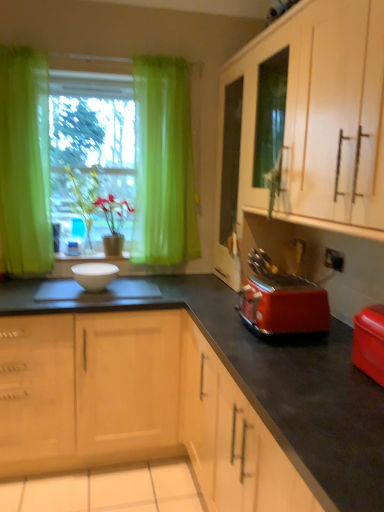
Describe the element at coordinates (91, 256) in the screenshot. The image size is (384, 512). I see `white glossy bowl at center` at that location.

Find the location of a particular element. white glossy bowl at center is located at coordinates (91, 256).

Image resolution: width=384 pixels, height=512 pixels. What are the coordinates of `green leafy plant at center` in the screenshot? It's located at (84, 198).

The image size is (384, 512). Describe the element at coordinates (84, 198) in the screenshot. I see `green leafy plant at center` at that location.

What do you see at coordinates (369, 342) in the screenshot? I see `matte plastic container at lower right` at bounding box center [369, 342].

Where is `white glossy bowl at center`? white glossy bowl at center is located at coordinates (94, 275).

You are a GUI agent. You are given a task and a screenshot of the screen. Output one action in this format:
    pyautogui.click(x=<x>, y=<y>)
    Task: Click on the white glossy bowl at center
    
    Given the screenshot: What is the action you would take?
    pyautogui.click(x=91, y=256)

Is green leafy plant at center in contact with matte plastic container at lower right?

No, green leafy plant at center is not in contact with matte plastic container at lower right.

Can you confirm if green leafy plant at center is thinner than matte plastic container at lower right?

No, green leafy plant at center is not thinner than matte plastic container at lower right.

Can you confirm if green leafy plant at center is positioned to the left of matte plastic container at lower right?

Correct, you'll find green leafy plant at center to the left of matte plastic container at lower right.

Is green leafy plant at center located outside matte plastic container at lower right?

Absolutely, green leafy plant at center is external to matte plastic container at lower right.

Is white glossy bowl at center inside red plastic toaster at lower right?

That's incorrect, white glossy bowl at center is not inside red plastic toaster at lower right.

From the picture: Does red plastic toaster at lower right turn towards white glossy bowl at center?

No, red plastic toaster at lower right is not turned towards white glossy bowl at center.

Considering the sizes of objects red plastic toaster at lower right and white glossy bowl at center in the image provided, who is wider, red plastic toaster at lower right or white glossy bowl at center?

red plastic toaster at lower right.

Image resolution: width=384 pixels, height=512 pixels. Identify the location of window sill above the red plastic toaster at lower right (from the image's perspective). pos(91,256).

How far apart are green leafy plant at center and white glossy bowl at center?

green leafy plant at center and white glossy bowl at center are 43.73 centimeters apart from each other.

Relative to white glossy bowl at center, is green leafy plant at center in front or behind?

green leafy plant at center is behind white glossy bowl at center.

Considering the relative sizes of green leafy plant at center and white glossy bowl at center in the image provided, is green leafy plant at center thinner than white glossy bowl at center?

Incorrect, the width of green leafy plant at center is not less than that of white glossy bowl at center.

From the image's perspective, does green leafy plant at center appear higher than white glossy bowl at center?

Yes, from the image's perspective, green leafy plant at center is over white glossy bowl at center.

Does matte plastic container at lower right have a greater height compared to white glossy bowl at center?

Correct, matte plastic container at lower right is much taller as white glossy bowl at center.

From the image's perspective, which one is positioned lower, matte plastic container at lower right or white glossy bowl at center?

From the image's view, matte plastic container at lower right is below.

Is white glossy bowl at center inside matte plastic container at lower right?

No, white glossy bowl at center is located outside of matte plastic container at lower right.

Considering their positions, is matte plastic container at lower right located in front of or behind white glossy bowl at center?

Clearly, matte plastic container at lower right is in front of white glossy bowl at center.

This screenshot has height=512, width=384. I want to click on window sill lying behind the green leafy plant at center, so click(91, 256).

Is white glossy bowl at center facing away from green leafy plant at center?

No.

From a real-world perspective, does white glossy bowl at center stand above green leafy plant at center?

No, from a real-world perspective, white glossy bowl at center is not over green leafy plant at center

How far apart are white glossy bowl at center and green leafy plant at center?

white glossy bowl at center and green leafy plant at center are 26.09 centimeters apart.

Considering the relative sizes of white glossy bowl at center and matte wood cabinet at upper right in the image provided, is white glossy bowl at center taller than matte wood cabinet at upper right?

No.

Is the depth of white glossy bowl at center less than that of matte wood cabinet at upper right?

No, white glossy bowl at center is further to the viewer.

Visually, is white glossy bowl at center positioned to the left or to the right of matte wood cabinet at upper right?

white glossy bowl at center is positioned on matte wood cabinet at upper right's left side.

From a real-world perspective, is white glossy bowl at center positioned under matte wood cabinet at upper right based on gravity?

Indeed, from a real-world perspective, white glossy bowl at center is positioned beneath matte wood cabinet at upper right.

Can you confirm if green leafy plant at center is taller than white glossy bowl at center?

Yes, green leafy plant at center is taller than white glossy bowl at center.

Is white glossy bowl at center at the back of green leafy plant at center?

No, green leafy plant at center is not facing the opposite direction of white glossy bowl at center.

Considering the relative sizes of green leafy plant at center and white glossy bowl at center in the image provided, is green leafy plant at center thinner than white glossy bowl at center?

No, green leafy plant at center is not thinner than white glossy bowl at center.

At what (x,y) coordinates should I click in order to perform the action: click on appliance that is below the green leafy plant at center (from the image's perspective). Please return your answer as a coordinate pair (x, y). Looking at the image, I should click on (369, 342).

Find the location of `kitchen appliance above the white glossy bowl at center (from a real-world perspective)`. kitchen appliance above the white glossy bowl at center (from a real-world perspective) is located at coordinates (284, 305).

From the image, which object appears to be farther from matte plastic container at lower right, matte wood cabinet at upper right or green sheer curtain at left?

Based on the image, green sheer curtain at left appears to be further to matte plastic container at lower right.

Considering their positions, is green sheer curtain at left positioned closer to matte wood cabinet at upper right than red plastic toaster at lower right?

The object closer to matte wood cabinet at upper right is red plastic toaster at lower right.

When comparing their distances from white glossy bowl at center, does white glossy bowl at center or green leafy plant at center seem further?

green leafy plant at center is positioned further to the anchor white glossy bowl at center.

Based on their spatial positions, is matte wood cabinet at upper right or matte plastic container at lower right further from green sheer curtain at left?

The object further to green sheer curtain at left is matte plastic container at lower right.

Considering their positions, is red plastic toaster at lower right positioned further to green leafy plant at center than matte wood cabinet at upper right?

Based on the image, red plastic toaster at lower right appears to be further to green leafy plant at center.

From the image, which object appears to be farther from red plastic toaster at lower right, matte plastic container at lower right or matte wood cabinet at upper right?

matte wood cabinet at upper right is positioned further to the anchor red plastic toaster at lower right.

From the image, which object appears to be farther from matte wood cabinet at upper right, red plastic toaster at lower right or white glossy bowl at center?

Based on the image, white glossy bowl at center appears to be further to matte wood cabinet at upper right.

Looking at the image, which one is located further to white glossy bowl at center, matte plastic container at lower right or white glossy bowl at center?

Among the two, matte plastic container at lower right is located further to white glossy bowl at center.

Where is `appliance between matte wood cabinet at upper right and green leafy plant at center in the front-back direction`? The height and width of the screenshot is (512, 384). appliance between matte wood cabinet at upper right and green leafy plant at center in the front-back direction is located at coordinates (369, 342).

Locate an element on the screen. This screenshot has width=384, height=512. kitchen appliance positioned between matte wood cabinet at upper right and white glossy bowl at center from near to far is located at coordinates (284, 305).

Where is `kitchen appliance between green leafy plant at center and matte plastic container at lower right`? This screenshot has width=384, height=512. kitchen appliance between green leafy plant at center and matte plastic container at lower right is located at coordinates (284, 305).

This screenshot has height=512, width=384. I want to click on kitchen appliance located between green sheer curtain at left and matte plastic container at lower right in the left-right direction, so click(284, 305).